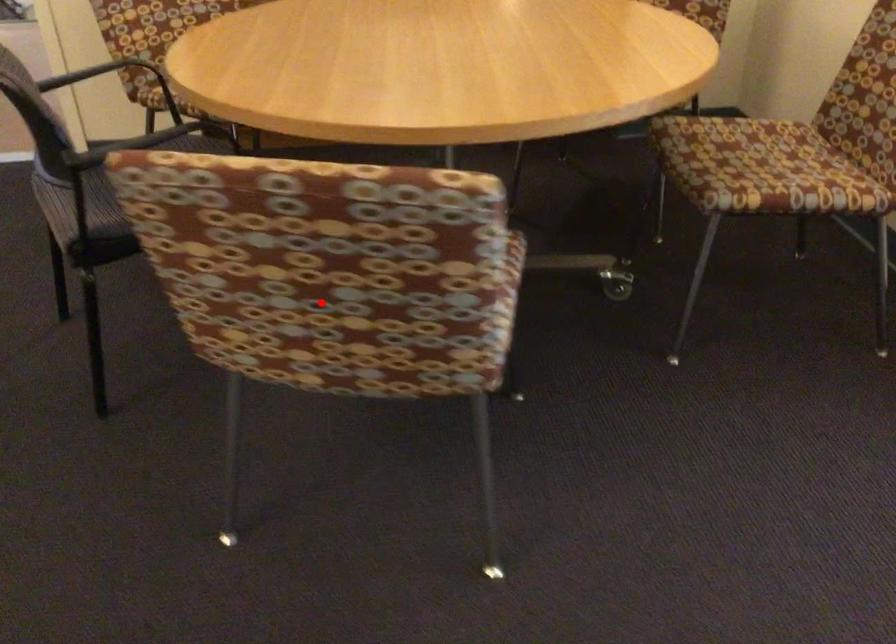
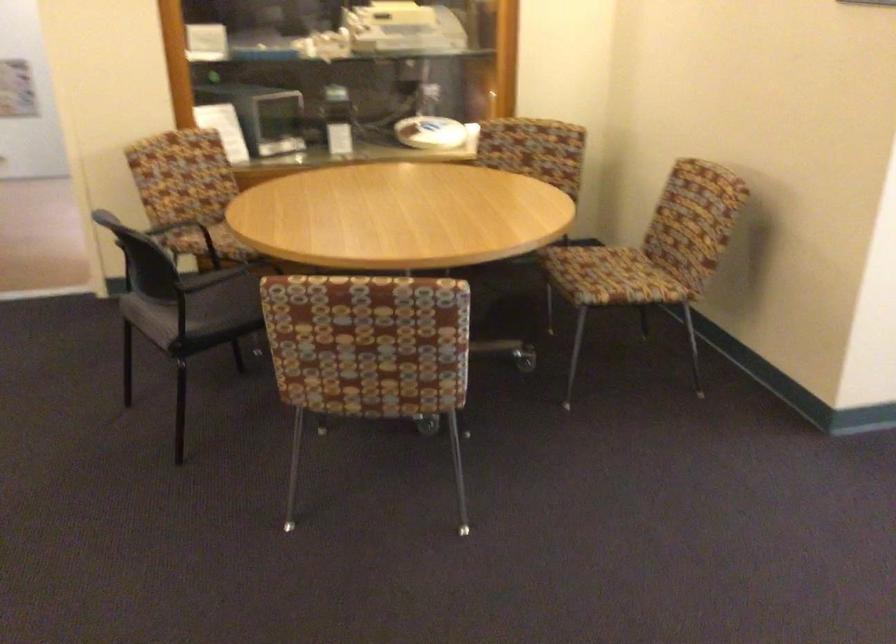
Question: A red point is marked in image1. In image2, is the corresponding 3D point closer to the camera or farther? Reply with the corresponding letter.

Choices:
 (A) The corresponding 3D point is closer.
 (B) The corresponding 3D point is farther.

Answer: (B)